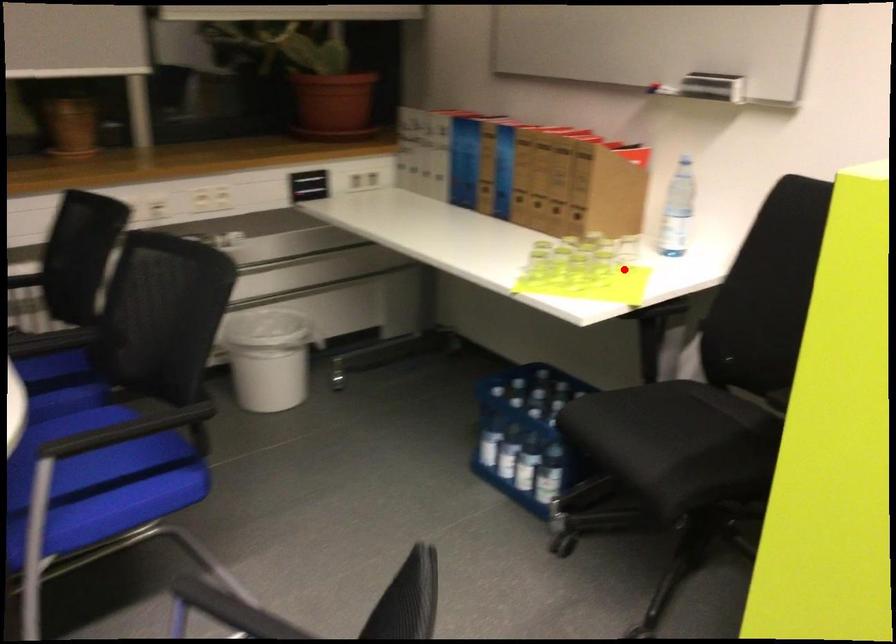
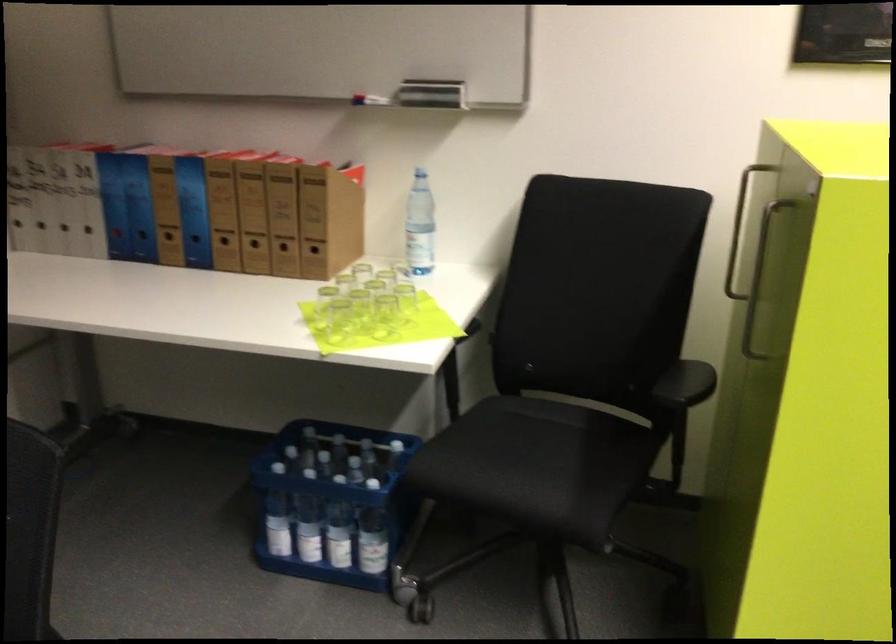
Question: I am providing you with two images of the same scene from different viewpoints. In image1, a red point is highlighted. Considering the same 3D point in image2, which of the following is correct?

Choices:
 (A) It is closer
 (B) It is farther

Answer: (A)